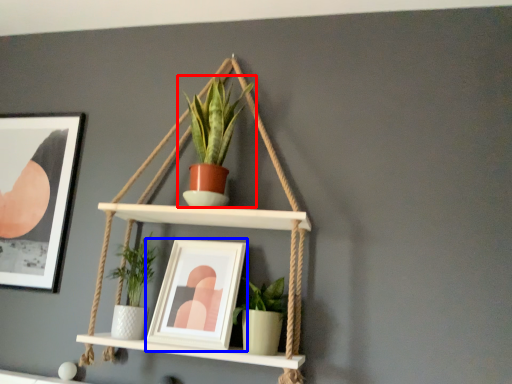
Question: Which object appears closest to the camera in this image, houseplant (highlighted by a red box) or picture frame (highlighted by a blue box)?

Choices:
 (A) houseplant
 (B) picture frame

Answer: (B)